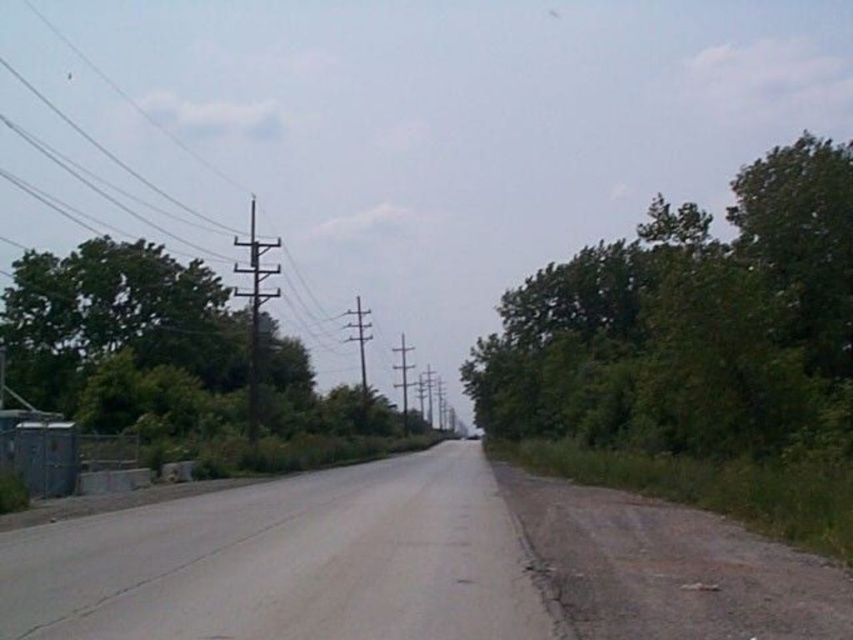
You are a painter standing at the end of the road. You need to paint the tallest telegraph pole first. Which one should you choose between the metallic gray telegraph pole at center and the smooth wood telegraph pole at center?

The metallic gray telegraph pole at center has a greater height compared to the smooth wood telegraph pole at center, so you should paint the metallic gray telegraph pole at center first.